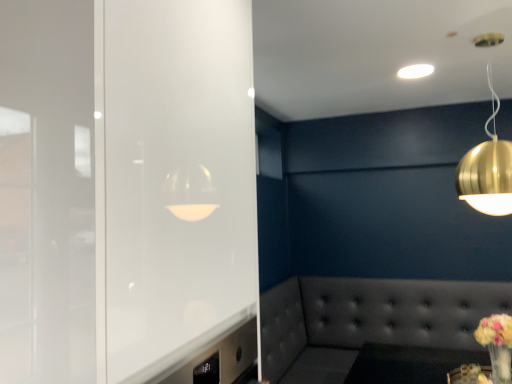
Where is `frosted glass door at left`? The image size is (512, 384). frosted glass door at left is located at coordinates (175, 190).

Find the location of a particular element. gold metallic sphere at upper right, the first lamp in the bottom-to-top sequence is located at coordinates (487, 169).

Which of these two, tufted leather couch at lower right or gold metallic sphere at upper right, placed as the second lamp when sorted from back to front, is smaller?

gold metallic sphere at upper right, placed as the second lamp when sorted from back to front.

Does tufted leather couch at lower right touch gold metallic sphere at upper right, the 2th lamp from the top?

No.

From a real-world perspective, is tufted leather couch at lower right below gold metallic sphere at upper right, the 2th lamp from the top?

Correct, in the physical world, tufted leather couch at lower right is lower than gold metallic sphere at upper right, the 2th lamp from the top.

Which object is more forward, tufted leather couch at lower right or gold metallic sphere at upper right, placed as the second lamp when sorted from back to front?

gold metallic sphere at upper right, placed as the second lamp when sorted from back to front.

The width and height of the screenshot is (512, 384). I want to click on floral arrangement that is on the right side of gold metallic sphere at upper right, the first lamp in the bottom-to-top sequence, so click(497, 344).

Is point (486, 38) behind point (507, 360)?

No, it is not.

Could you tell me if gold metallic sphere at upper right, positioned as the first lamp in front-to-back order, is turned towards pastel yellow bouquet at lower right?

No, gold metallic sphere at upper right, positioned as the first lamp in front-to-back order, is not turned towards pastel yellow bouquet at lower right.

From a real-world perspective, is gold metallic sphere at upper right, placed as the second lamp when sorted from back to front, located beneath pastel yellow bouquet at lower right?

No, from a real-world perspective, gold metallic sphere at upper right, placed as the second lamp when sorted from back to front, is not beneath pastel yellow bouquet at lower right.

Is frosted glass door at left with tufted leather couch at lower right?

frosted glass door at left and tufted leather couch at lower right are clearly separated.

From a real-world perspective, is frosted glass door at left on tufted leather couch at lower right?

Correct, in the physical world, frosted glass door at left is higher than tufted leather couch at lower right.

Looking at this image, from the image's perspective, is frosted glass door at left under tufted leather couch at lower right?

Incorrect, from the image's perspective, frosted glass door at left is higher than tufted leather couch at lower right.

Between point (100, 73) and point (401, 282), which one is positioned in front?

The point (100, 73) is closer to the camera.

Is frosted glass door at left further to the viewer compared to gold metallic sphere at upper right, placed as the second lamp when sorted from back to front?

No, it is not.

Is frosted glass door at left not close to gold metallic sphere at upper right, the first lamp in the bottom-to-top sequence?

That's right, there is a large distance between frosted glass door at left and gold metallic sphere at upper right, the first lamp in the bottom-to-top sequence.

Is frosted glass door at left wider or thinner than gold metallic sphere at upper right, positioned as the first lamp in front-to-back order?

Clearly, frosted glass door at left has more width compared to gold metallic sphere at upper right, positioned as the first lamp in front-to-back order.

Is point (420, 67) in front of point (483, 172)?

No, it is not.

Between white glossy ceiling light at upper center, positioned as the second lamp in front-to-back order, and gold metallic sphere at upper right, the first lamp in the bottom-to-top sequence, which one has smaller width?

white glossy ceiling light at upper center, positioned as the second lamp in front-to-back order, is thinner.

Considering the positions of objects white glossy ceiling light at upper center, positioned as the second lamp in front-to-back order, and gold metallic sphere at upper right, positioned as the first lamp in front-to-back order, in the image provided, who is behind, white glossy ceiling light at upper center, positioned as the second lamp in front-to-back order, or gold metallic sphere at upper right, positioned as the first lamp in front-to-back order,?

white glossy ceiling light at upper center, positioned as the second lamp in front-to-back order, is further from the camera.

Does white glossy ceiling light at upper center, the first lamp when ordered from top to bottom, have a lesser height compared to gold metallic sphere at upper right, the 2th lamp from the top?

→ Indeed, white glossy ceiling light at upper center, the first lamp when ordered from top to bottom, has a lesser height compared to gold metallic sphere at upper right, the 2th lamp from the top.

Is frosted glass door at left situated inside pastel yellow bouquet at lower right or outside?

frosted glass door at left lies outside pastel yellow bouquet at lower right.

Can you confirm if frosted glass door at left is taller than pastel yellow bouquet at lower right?

Yes, frosted glass door at left is taller than pastel yellow bouquet at lower right.

Which object is positioned more to the left, frosted glass door at left or pastel yellow bouquet at lower right?

Positioned to the left is frosted glass door at left.

Who is more distant, frosted glass door at left or pastel yellow bouquet at lower right?

A: pastel yellow bouquet at lower right is behind.

From a real-world perspective, who is located higher, gold metallic sphere at upper right, positioned as the first lamp in front-to-back order, or frosted glass door at left?

In real-world perspective, gold metallic sphere at upper right, positioned as the first lamp in front-to-back order, is above.

In terms of height, does gold metallic sphere at upper right, positioned as the first lamp in front-to-back order, look taller or shorter compared to frosted glass door at left?

In the image, gold metallic sphere at upper right, positioned as the first lamp in front-to-back order, appears to be shorter than frosted glass door at left.

Is point (482, 180) positioned before point (161, 217)?

No, (482, 180) is further to viewer.

Can you confirm if gold metallic sphere at upper right, the first lamp in the bottom-to-top sequence, is thinner than frosted glass door at left?

Indeed, gold metallic sphere at upper right, the first lamp in the bottom-to-top sequence, has a lesser width compared to frosted glass door at left.

Which lamp is the 2nd one when counting from the front of the tufted leather couch at lower right? Please provide its 2D coordinates.

[(487, 169)]

Where is `floral arrangement that is on the right side of gold metallic sphere at upper right, placed as the second lamp when sorted from back to front`? The image size is (512, 384). floral arrangement that is on the right side of gold metallic sphere at upper right, placed as the second lamp when sorted from back to front is located at coordinates (497, 344).

From the image, which object appears to be nearer to pastel yellow bouquet at lower right, tufted leather couch at lower right or frosted glass door at left?

tufted leather couch at lower right is positioned closer to the anchor pastel yellow bouquet at lower right.

When comparing their distances from pastel yellow bouquet at lower right, does tufted leather couch at lower right or white glossy ceiling light at upper center, arranged as the first lamp when viewed from the back, seem further?

white glossy ceiling light at upper center, arranged as the first lamp when viewed from the back.

Which object lies further to the anchor point frosted glass door at left, pastel yellow bouquet at lower right or gold metallic sphere at upper right, the first lamp in the bottom-to-top sequence?

pastel yellow bouquet at lower right is positioned further to the anchor frosted glass door at left.

Which object lies further to the anchor point tufted leather couch at lower right, white glossy ceiling light at upper center, the 2th lamp in the bottom-to-top sequence, or pastel yellow bouquet at lower right?

The object further to tufted leather couch at lower right is white glossy ceiling light at upper center, the 2th lamp in the bottom-to-top sequence.

From the image, which object appears to be nearer to white glossy ceiling light at upper center, positioned as the second lamp in front-to-back order, frosted glass door at left or pastel yellow bouquet at lower right?

pastel yellow bouquet at lower right is positioned closer to the anchor white glossy ceiling light at upper center, positioned as the second lamp in front-to-back order.

From the image, which object appears to be farther from white glossy ceiling light at upper center, positioned as the second lamp in front-to-back order, gold metallic sphere at upper right, the 2th lamp from the top, or frosted glass door at left?

frosted glass door at left lies further to white glossy ceiling light at upper center, positioned as the second lamp in front-to-back order, than the other object.

Which object lies further to the anchor point gold metallic sphere at upper right, the 2th lamp from the top, pastel yellow bouquet at lower right or frosted glass door at left?

Among the two, frosted glass door at left is located further to gold metallic sphere at upper right, the 2th lamp from the top.

Looking at the image, which one is located closer to white glossy ceiling light at upper center, the first lamp when ordered from top to bottom, pastel yellow bouquet at lower right or gold metallic sphere at upper right, positioned as the first lamp in front-to-back order?

gold metallic sphere at upper right, positioned as the first lamp in front-to-back order, is positioned closer to the anchor white glossy ceiling light at upper center, the first lamp when ordered from top to bottom.

The image size is (512, 384). What are the coordinates of `lamp between white glossy ceiling light at upper center, arranged as the first lamp when viewed from the back, and pastel yellow bouquet at lower right from top to bottom` in the screenshot? It's located at (487, 169).

Find the location of a particular element. Image resolution: width=512 pixels, height=384 pixels. floral arrangement between frosted glass door at left and white glossy ceiling light at upper center, arranged as the first lamp when viewed from the back, from front to back is located at coordinates (497, 344).

At what (x,y) coordinates should I click in order to perform the action: click on floral arrangement between gold metallic sphere at upper right, the 2th lamp from the top, and tufted leather couch at lower right vertically. Please return your answer as a coordinate pair (x, y). Image resolution: width=512 pixels, height=384 pixels. Looking at the image, I should click on (497, 344).

Find the location of a particular element. Image resolution: width=512 pixels, height=384 pixels. floral arrangement located between frosted glass door at left and tufted leather couch at lower right in the depth direction is located at coordinates point(497,344).